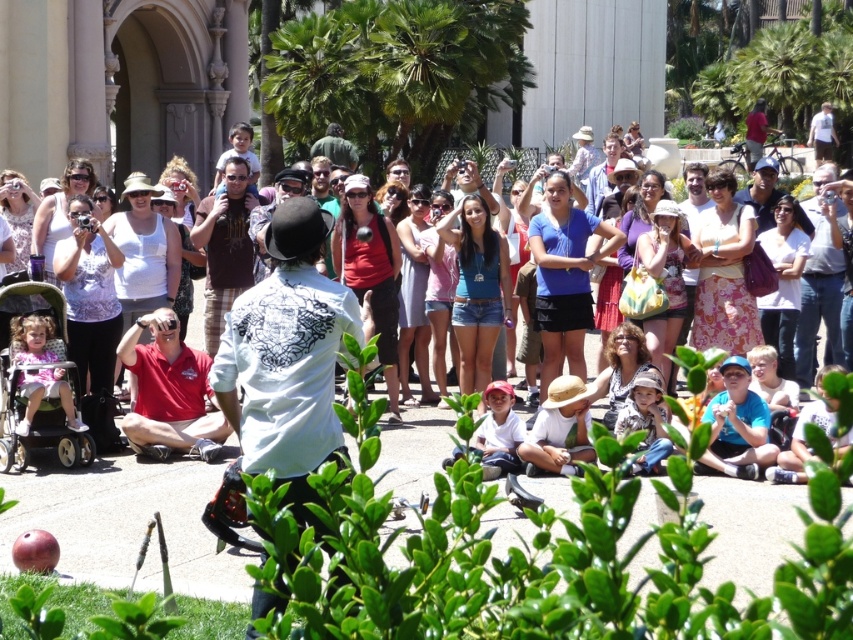
You are standing in the crowd and want to take a photo of the person in the white printed shirt at center and the brown cotton shirt at center. Which one is on the right side when facing the scene?

The white printed shirt at center is positioned on the right side of brown cotton shirt at center, so when facing the scene, the white printed shirt at center is on the right side.

You are a photographer trying to capture a clear shot of both the red cotton shirt at center and the brown cotton shirt at center. Given that your camera lens can only focus on objects within a 30 cm width range, can you determine if both shirts will fit within the focus range?

The red cotton shirt at center is larger in width than the brown cotton shirt at center. Since the total width required to include both would depend on their combined size, but the exact distance between them isn